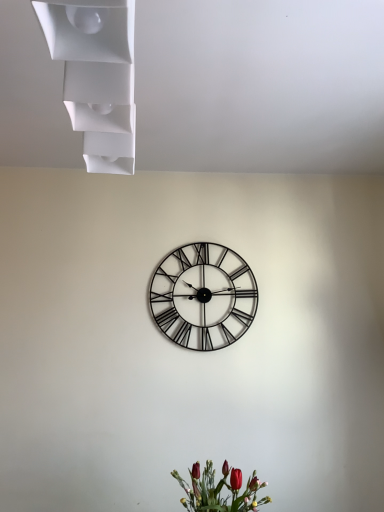
Question: In terms of height, does metallic black clock at center look taller or shorter compared to matte red flowers at lower center?

Choices:
 (A) tall
 (B) short

Answer: (A)

Question: Is metallic black clock at center inside the boundaries of matte red flowers at lower center, or outside?

Choices:
 (A) inside
 (B) outside

Answer: (B)

Question: Which is nearer to the white matte shelf at upper left?

Choices:
 (A) metallic black clock at center
 (B) matte red flowers at lower center

Answer: (B)

Question: Estimate the real-world distances between objects in this image. Which object is closer to the matte red flowers at lower center?

Choices:
 (A) white matte shelf at upper left
 (B) metallic black clock at center

Answer: (B)